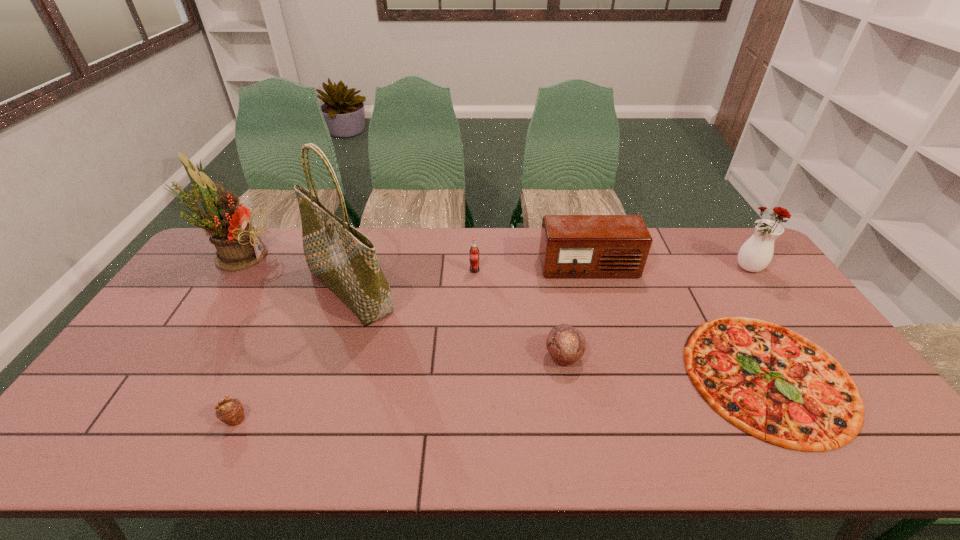
The image size is (960, 540). I want to click on shopping bag, so click(x=344, y=259).

Where is `the seventh shortest object`? the seventh shortest object is located at coordinates (238, 244).

Find the location of `flower arrangement`. flower arrangement is located at coordinates (238, 244).

Find the location of `vase`. vase is located at coordinates (755, 254).

The height and width of the screenshot is (540, 960). Find the location of `the fifth shortest object`. the fifth shortest object is located at coordinates (571, 246).

Locate an element on the screen. The width and height of the screenshot is (960, 540). soda bottle is located at coordinates (474, 251).

The width and height of the screenshot is (960, 540). I want to click on the fifth tallest object, so tap(474, 251).

I want to click on the taller muffin, so click(566, 344).

I want to click on the farther muffin, so click(566, 344).

The width and height of the screenshot is (960, 540). I want to click on the shorter muffin, so click(230, 411).